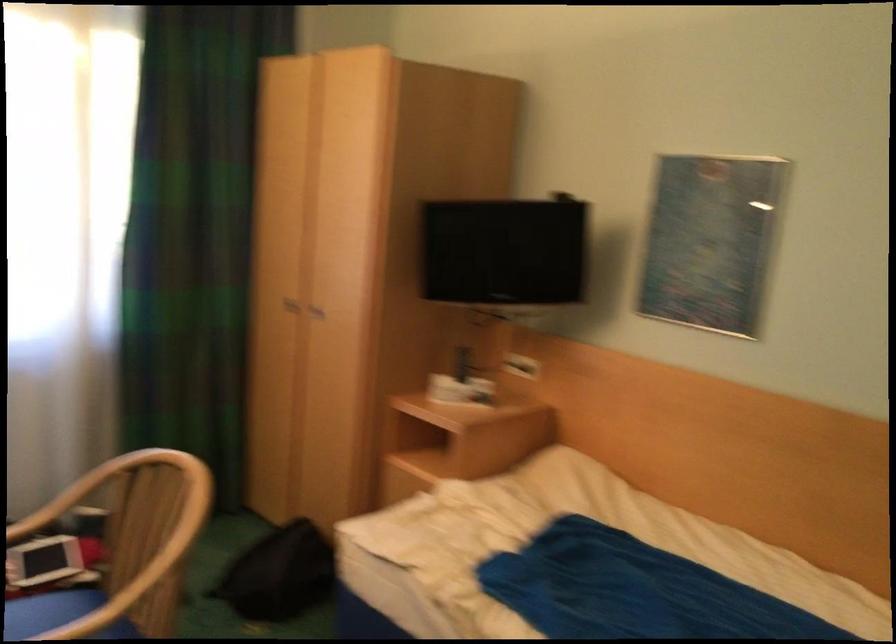
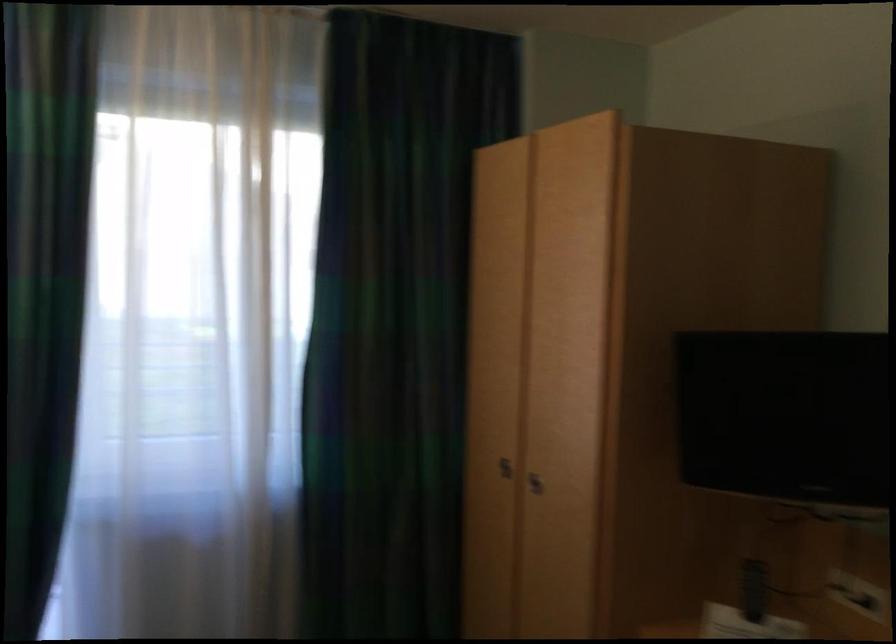
Where in the second image is the point corresponding to pixel 295 307 from the first image?

(504, 468)